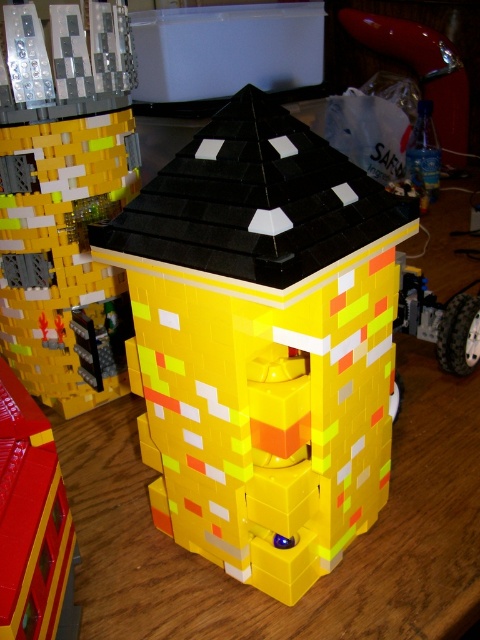
Question: Estimate the real-world distances between objects in this image. Which object is closer to the brick-like yellow toy at lower left?

Choices:
 (A) yellow matte building at center
 (B) yellow plastic toy at center

Answer: (B)

Question: Can you confirm if yellow matte building at center is positioned above brick-like yellow toy at lower left?

Choices:
 (A) yes
 (B) no

Answer: (A)

Question: Does yellow plastic toy at center appear on the left side of yellow matte building at center?

Choices:
 (A) yes
 (B) no

Answer: (B)

Question: Which is nearer to the brick-like yellow toy at lower left?

Choices:
 (A) yellow matte building at center
 (B) yellow plastic toy at center

Answer: (B)

Question: Which object is closer to the camera taking this photo?

Choices:
 (A) yellow plastic toy at center
 (B) yellow matte building at center
 (C) brick-like yellow toy at lower left

Answer: (C)

Question: Does yellow plastic toy at center appear on the left side of brick-like yellow toy at lower left?

Choices:
 (A) yes
 (B) no

Answer: (B)